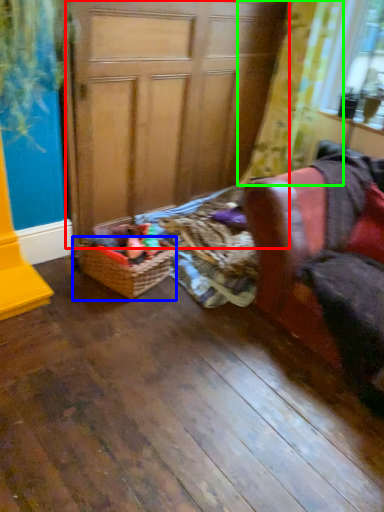
Question: Which is farther away from screen door (highlighted by a red box)? basket (highlighted by a blue box) or curtain (highlighted by a green box)?

Choices:
 (A) basket
 (B) curtain

Answer: (A)